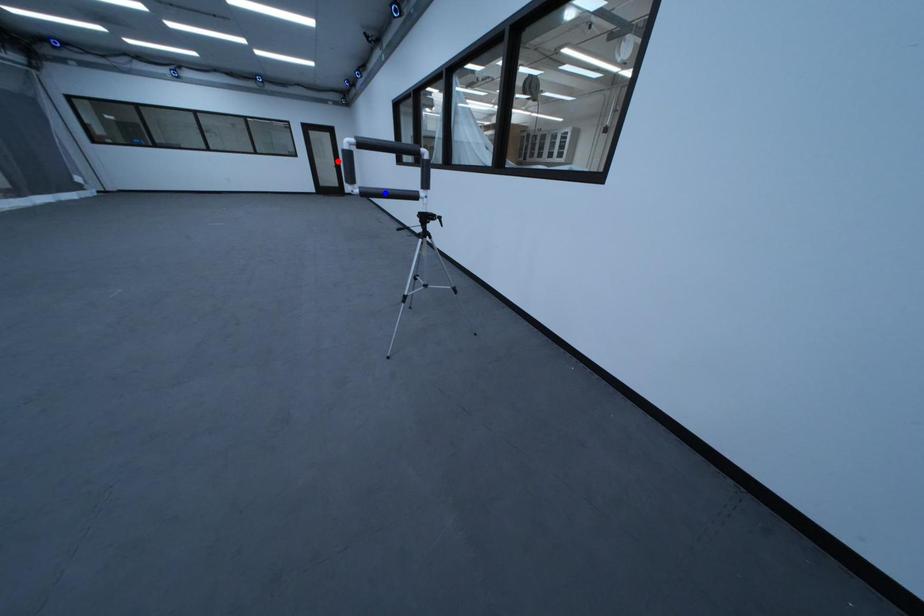
Question: In the image, two points are highlighted. Which point is nearer to the camera? Reply with the corresponding letter.

Choices:
 (A) blue point
 (B) red point

Answer: (B)